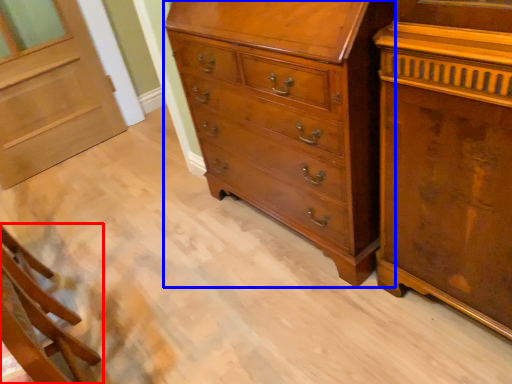
Question: Which of the following is the closest to the observer, furniture (highlighted by a red box) or chest of drawers (highlighted by a blue box)?

Choices:
 (A) furniture
 (B) chest of drawers

Answer: (A)